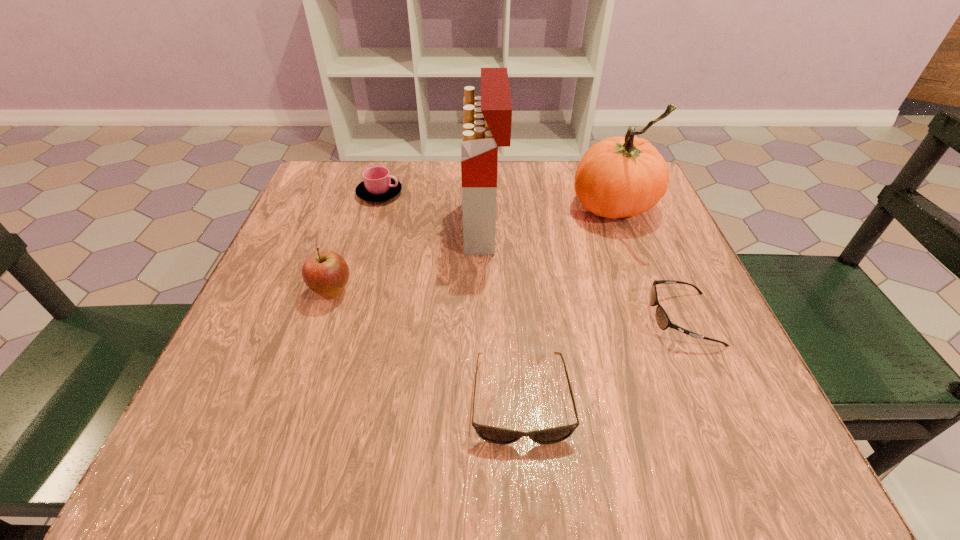
Identify the location of vacant space at the far left corner of the desktop. The width and height of the screenshot is (960, 540). (346, 170).

In the image, there is a desktop. Where is `vacant space at the near left corner`? vacant space at the near left corner is located at coordinates (205, 441).

At what (x,y) coordinates should I click in order to perform the action: click on blank space at the near right corner of the desktop. Please return your answer as a coordinate pair (x, y). Looking at the image, I should click on (708, 461).

Image resolution: width=960 pixels, height=540 pixels. What are the coordinates of `free spot between the right sunglasses and the cigarette case` in the screenshot? It's located at (584, 273).

You are a GUI agent. You are given a task and a screenshot of the screen. Output one action in this format:
    pyautogui.click(x=<x>, y=<y>)
    Task: Click on the free spot between the farther sunglasses and the cup
    This screenshot has height=540, width=960.
    Given the screenshot: What is the action you would take?
    pyautogui.click(x=531, y=256)

I want to click on vacant space that's between the cigarette case and the cup, so click(x=432, y=210).

Image resolution: width=960 pixels, height=540 pixels. I want to click on free point between the nearest object and the pumpkin, so click(x=567, y=303).

I want to click on vacant area that lies between the nearest object and the cigarette case, so pyautogui.click(x=502, y=313).

The image size is (960, 540). I want to click on free space between the right sunglasses and the third tallest object, so point(507,305).

You are a GUI agent. You are given a task and a screenshot of the screen. Output one action in this format:
    pyautogui.click(x=<x>, y=<y>)
    Task: Click on the vacant area between the pumpkin and the cigarette case
    
    Given the screenshot: What is the action you would take?
    coord(549,217)